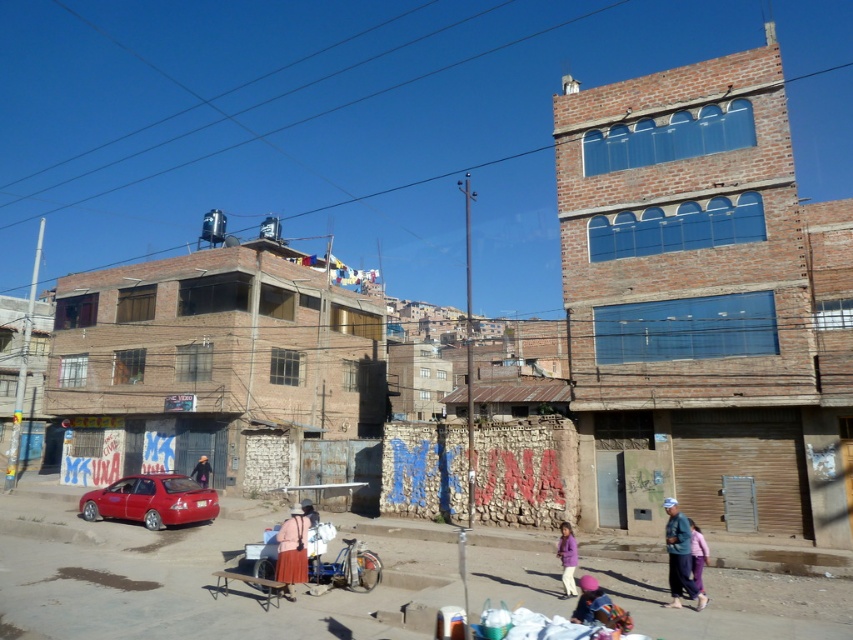
Question: Estimate the real-world distances between objects in this image. Which object is farther from the matte pink coat at center?

Choices:
 (A) purple fabric at center
 (B) metallic red car at lower left
 (C) shiny red sedan at lower left
 (D) blue fabric child at lower center

Answer: (D)

Question: Is shiny red sedan at lower left below matte black jacket at center?

Choices:
 (A) no
 (B) yes

Answer: (A)

Question: Which object appears closest to the camera in this image?

Choices:
 (A) shiny red sedan at lower left
 (B) matte pink coat at center
 (C) blue fabric child at lower center

Answer: (C)

Question: Among these points, which one is nearest to the camera?

Choices:
 (A) pyautogui.click(x=564, y=563)
 (B) pyautogui.click(x=677, y=566)
 (C) pyautogui.click(x=694, y=560)

Answer: (C)

Question: Is metallic red car at lower left thinner than blue denim jacket at lower right?

Choices:
 (A) no
 (B) yes

Answer: (A)

Question: Considering the relative positions of shiny red sedan at lower left and matte black jacket at center in the image provided, where is shiny red sedan at lower left located with respect to matte black jacket at center?

Choices:
 (A) right
 (B) left

Answer: (A)